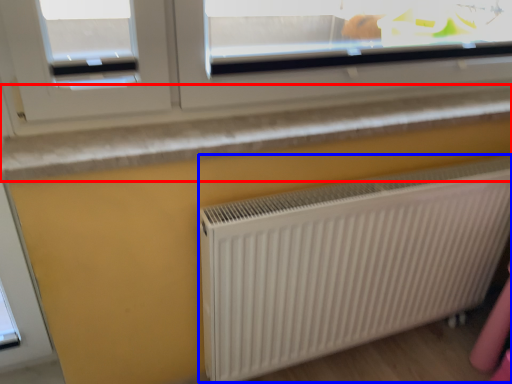
Question: Among these objects, which one is farthest to the camera, window sill (highlighted by a red box) or radiator (highlighted by a blue box)?

Choices:
 (A) window sill
 (B) radiator

Answer: (B)